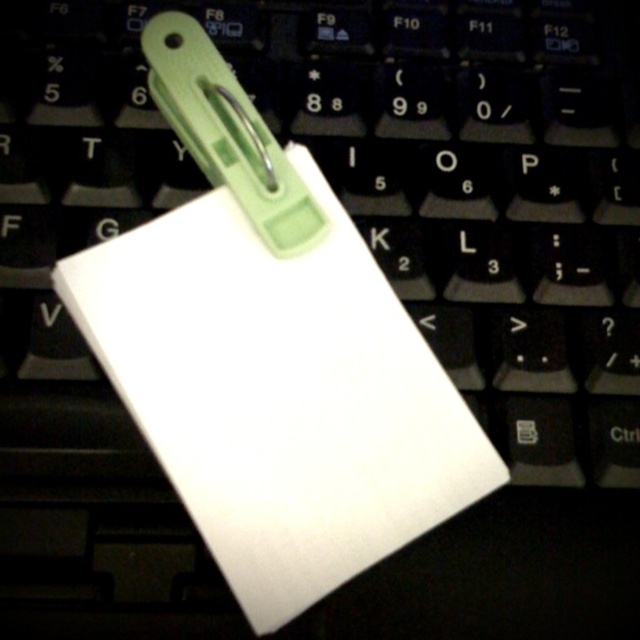
How far apart are white matte notepad at center and green plastic clip at center?

white matte notepad at center is 5.05 inches from green plastic clip at center.

Can you confirm if white matte notepad at center is smaller than green plastic clip at center?

Actually, white matte notepad at center might be larger than green plastic clip at center.

You are a GUI agent. You are given a task and a screenshot of the screen. Output one action in this format:
    pyautogui.click(x=<x>, y=<y>)
    Task: Click on the white matte notepad at center
    
    Given the screenshot: What is the action you would take?
    pyautogui.click(x=278, y=394)

This screenshot has height=640, width=640. In order to click on white matte notepad at center in this screenshot , I will do `click(278, 394)`.